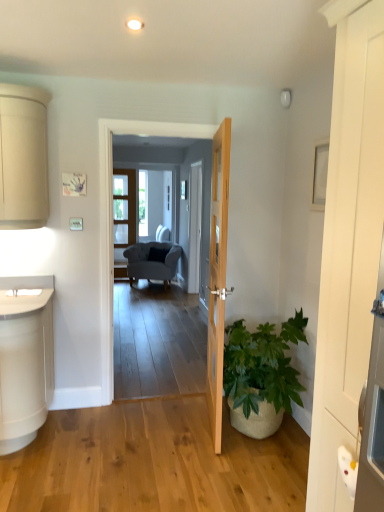
Where is `blank area to the left of natural wood door at center, which is the second door from front to back`? blank area to the left of natural wood door at center, which is the second door from front to back is located at coordinates (154, 423).